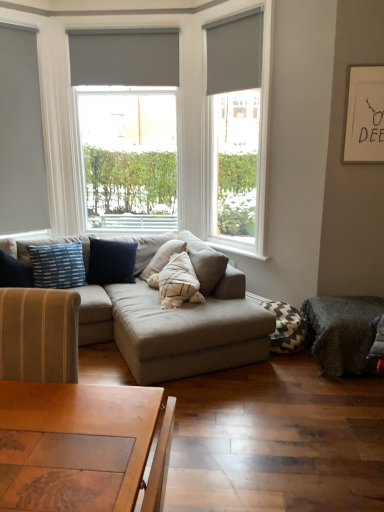
Question: Can you confirm if matte gray blind at upper right, acting as the 1th blind starting from the right, is shorter than matte gray couch at center?

Choices:
 (A) yes
 (B) no

Answer: (A)

Question: Considering the relative sizes of matte gray blind at upper right, placed as the first blind when sorted from front to back, and matte gray couch at center in the image provided, is matte gray blind at upper right, placed as the first blind when sorted from front to back, bigger than matte gray couch at center?

Choices:
 (A) yes
 (B) no

Answer: (B)

Question: Is matte gray blind at upper right, acting as the 1th blind starting from the right, closer to the viewer compared to matte gray couch at center?

Choices:
 (A) no
 (B) yes

Answer: (A)

Question: Does matte gray blind at upper right, acting as the second blind starting from the left, turn towards matte gray couch at center?

Choices:
 (A) yes
 (B) no

Answer: (B)

Question: Is matte gray blind at upper right, acting as the 1th blind starting from the right, not near matte gray couch at center?

Choices:
 (A) yes
 (B) no

Answer: (A)

Question: From a real-world perspective, is matte gray blind at upper right, placed as the first blind when sorted from front to back, physically above matte gray couch at center?

Choices:
 (A) yes
 (B) no

Answer: (A)

Question: Is matte gray blind at upper center, the 2th blind in the front-to-back sequence, not near matte gray roller shade at center, which appears as the second window when viewed from the left?

Choices:
 (A) yes
 (B) no

Answer: (B)

Question: Can you confirm if matte gray blind at upper center, the 2th blind in the front-to-back sequence, is thinner than matte gray roller shade at center, the second window viewed from the right?

Choices:
 (A) yes
 (B) no

Answer: (A)

Question: Does matte gray blind at upper center, which is the first blind in back-to-front order, touch matte gray roller shade at center, which appears as the second window when viewed from the left?

Choices:
 (A) no
 (B) yes

Answer: (B)

Question: Does matte gray blind at upper center, which is the second blind from right to left, appear on the left side of matte gray roller shade at center, the second window viewed from the right?

Choices:
 (A) no
 (B) yes

Answer: (A)

Question: Is matte gray blind at upper center, which is the first blind in back-to-front order, closer to the viewer compared to matte gray roller shade at center, the second window viewed from the right?

Choices:
 (A) no
 (B) yes

Answer: (A)

Question: Considering the relative sizes of matte gray blind at upper center, which is the first blind in back-to-front order, and matte gray roller shade at center, which appears as the second window when viewed from the left, in the image provided, is matte gray blind at upper center, which is the first blind in back-to-front order, smaller than matte gray roller shade at center, which appears as the second window when viewed from the left,?

Choices:
 (A) no
 (B) yes

Answer: (B)

Question: Can you confirm if matte gray blind at upper right, the 2th blind from the back, is smaller than chevron-patterned fabric pillow at lower right, the second pillow in the left-to-right sequence?

Choices:
 (A) no
 (B) yes

Answer: (B)